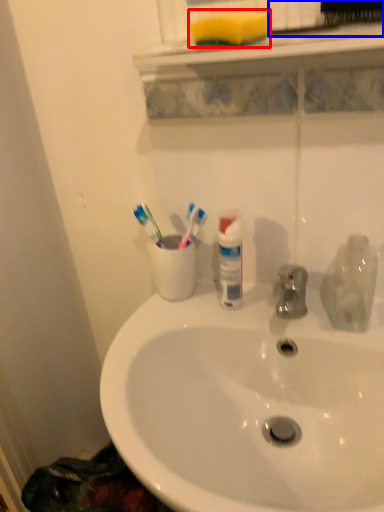
Question: Which point is further to the camera, soap (highlighted by a red box) or brush (highlighted by a blue box)?

Choices:
 (A) soap
 (B) brush

Answer: (A)